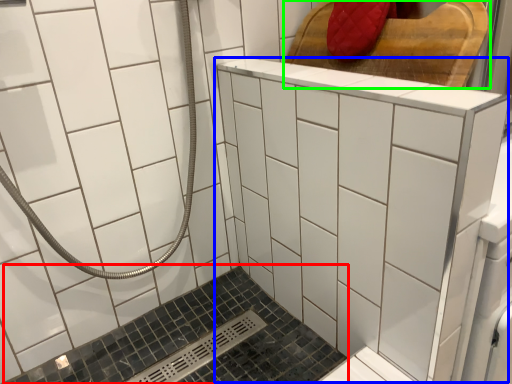
Question: Considering the real-world distances, which object is closest to bath (highlighted by a red box)? ceramic tile (highlighted by a blue box) or furniture (highlighted by a green box).

Choices:
 (A) ceramic tile
 (B) furniture

Answer: (A)